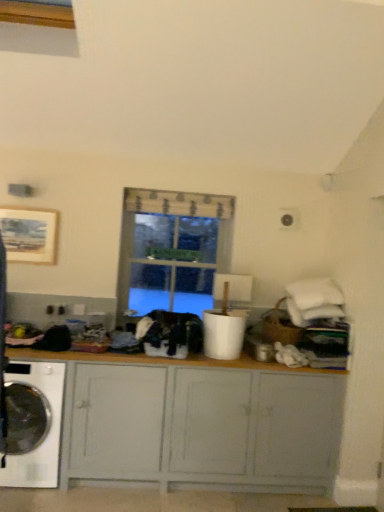
Question: From the image's perspective, relative to black fabric at center, is matte gray cabinet at center above or below?

Choices:
 (A) above
 (B) below

Answer: (B)

Question: Is matte gray cabinet at center bigger or smaller than black fabric at center?

Choices:
 (A) small
 (B) big

Answer: (B)

Question: Considering the real-world distances, which object is farthest from the clear glass window at center?

Choices:
 (A) white glossy washing machine at lower left
 (B) black fabric at center
 (C) matte gray cabinet at center

Answer: (A)

Question: Which object is the closest to the clear glass window at center?

Choices:
 (A) matte gray cabinet at center
 (B) white glossy washing machine at lower left
 (C) black fabric at center

Answer: (C)